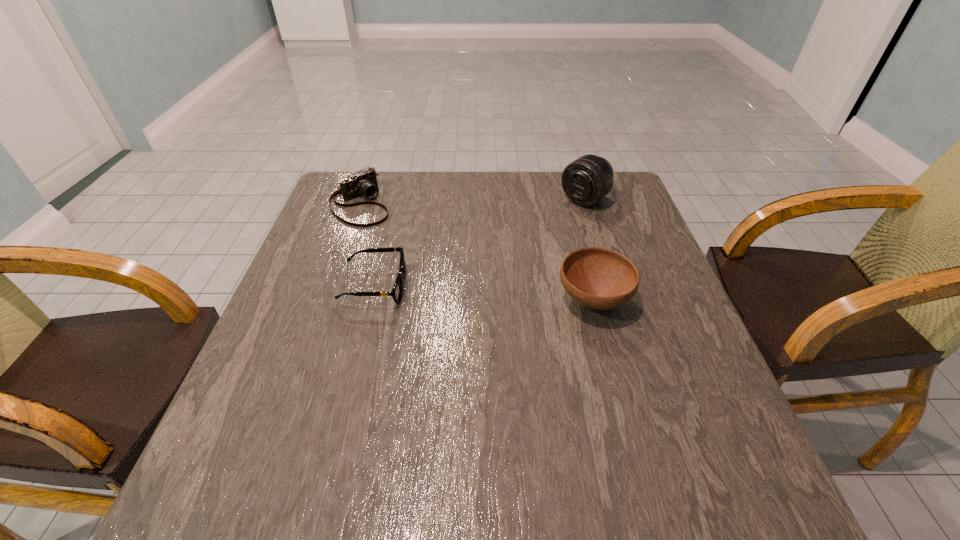
Identify the location of empty space that is in between the second tallest object and the third tallest object. (477, 252).

Identify the location of free point between the camera and the tallest object. (472, 201).

Find the location of `unoccupied position between the second tallest object and the shortest object`. unoccupied position between the second tallest object and the shortest object is located at coordinates (484, 293).

Locate an element on the screen. This screenshot has width=960, height=540. empty location between the bowl and the camera is located at coordinates (477, 252).

Point out which object is positioned as the second nearest to the telephoto lens. Please provide its 2D coordinates. Your answer should be formatted as a tuple, i.e. [(x, y)], where the tuple contains the x and y coordinates of a point satisfying the conditions above.

[(397, 290)]

Select which object is the second closest to the telephoto lens. Please provide its 2D coordinates. Your answer should be formatted as a tuple, i.e. [(x, y)], where the tuple contains the x and y coordinates of a point satisfying the conditions above.

[(397, 290)]

I want to click on free space that satisfies the following two spatial constraints: 1. on the front side of the sunglasses; 2. on the front-facing side of the second shortest object, so coord(331,286).

The width and height of the screenshot is (960, 540). I want to click on vacant space that satisfies the following two spatial constraints: 1. on the front side of the camera; 2. on the front-facing side of the shortest object, so click(x=331, y=286).

I want to click on free space in the image that satisfies the following two spatial constraints: 1. on the front side of the third tallest object; 2. on the front-facing side of the sunglasses, so click(331, 286).

Identify the location of blank area in the image that satisfies the following two spatial constraints: 1. on the front side of the second shortest object; 2. on the front-facing side of the shortest object. The image size is (960, 540). (331, 286).